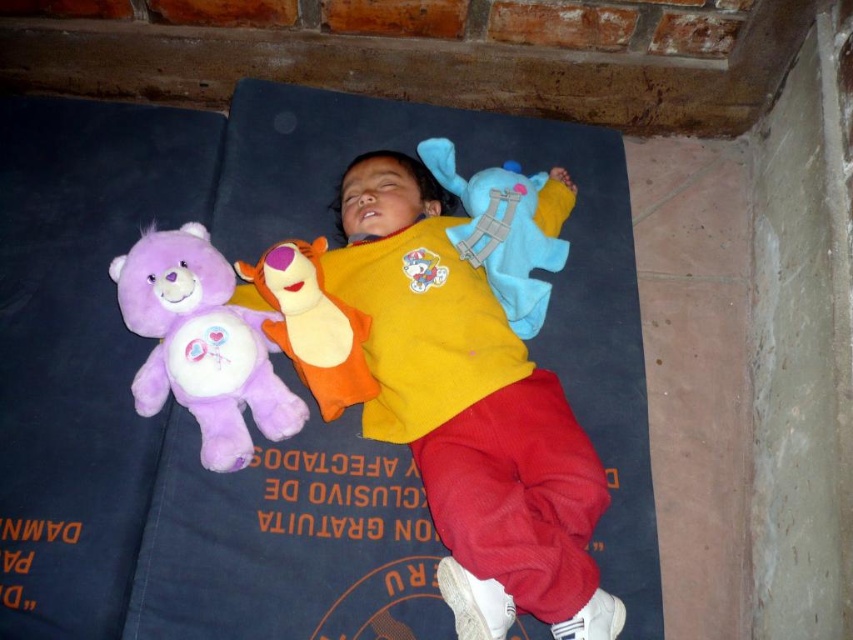
You are a photographer setting up a camera at eye level with the child. You want to capture a closeup shot of the yellow soft fabric shirt at center and the blue plush toy at upper center. Which object will appear larger in the photo?

The yellow soft fabric shirt at center will appear larger in the photo because it has a greater height compared to the blue plush toy at upper center.

You are a photographer taking a picture of the scene. You want to focus on the yellow soft fabric shirt at center and the purple plush tiger at center. Which object should you adjust your camera focus on first if you want to ensure both are in focus?

The yellow soft fabric shirt at center is closer to the viewer than the purple plush tiger at center, so you should focus on the yellow soft fabric shirt at center first to ensure both are in focus.

You are a parent looking at your child in the image. You want to place a small nightlight on the blue plush toy at upper center so it can be seen from the yellow soft fabric shirt at center. Is the nightlight visible from the shirt?

The yellow soft fabric shirt at center is to the left of the blue plush toy at upper center, so the nightlight placed on the blue plush toy at upper center would be visible from the shirt as they are positioned next to each other.